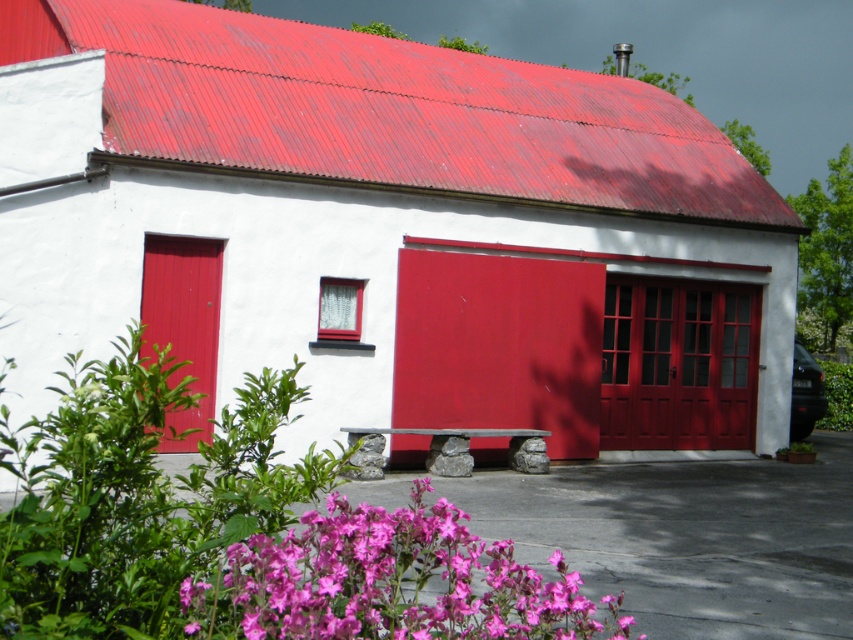
Question: Is metallic red roof at upper center above matte red door at center?

Choices:
 (A) no
 (B) yes

Answer: (B)

Question: Does smooth white barn at center appear under metallic red roof at upper center?

Choices:
 (A) no
 (B) yes

Answer: (B)

Question: Does smooth white barn at center have a larger size compared to pink matte flowers at lower center?

Choices:
 (A) yes
 (B) no

Answer: (A)

Question: Estimate the real-world distances between objects in this image. Which object is farther from the smooth white barn at center?

Choices:
 (A) matte red door at center
 (B) metallic red roof at upper center

Answer: (A)

Question: Which is nearer to the metallic red roof at upper center?

Choices:
 (A) pink matte flowers at lower center
 (B) matte red door at center
 (C) smooth white barn at center

Answer: (C)

Question: Which point is farther to the camera?

Choices:
 (A) smooth white barn at center
 (B) metallic red roof at upper center

Answer: (B)